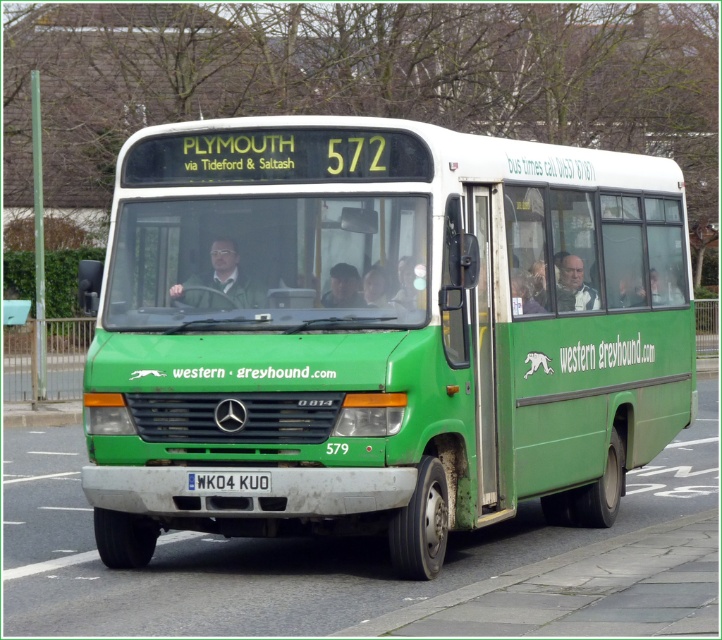
You are a delivery person who needs to place a small package between the white plastic license plate at center and the dark brown leather jacket at center. The package is 3 feet long. Will it fit in the space between them?

The distance between the white plastic license plate at center and the dark brown leather jacket at center is 4.35 feet. Since the package is 3 feet long, it will fit in the space between them.

You are a passenger on the Western Greyhound bus route 572. You notice two items at the center of the bus. One is the white plastic license plate at center, and the other is the dark brown leather jacket at center. From your seat, which item is located to the left?

The white plastic license plate at center is positioned on the left side of dark brown leather jacket at center, so from your seat, the white plastic license plate at center is to the left of the dark brown leather jacket at center.

You are a delivery person who needs to load a package onto the green matte bus at center. The loading ramp you have is 7 meters long. Will the ramp be sufficient to reach the bus?

The distance between you and the green matte bus at center is 7.06 meters, so the 7 meter ramp will be slightly too short to reach the bus.